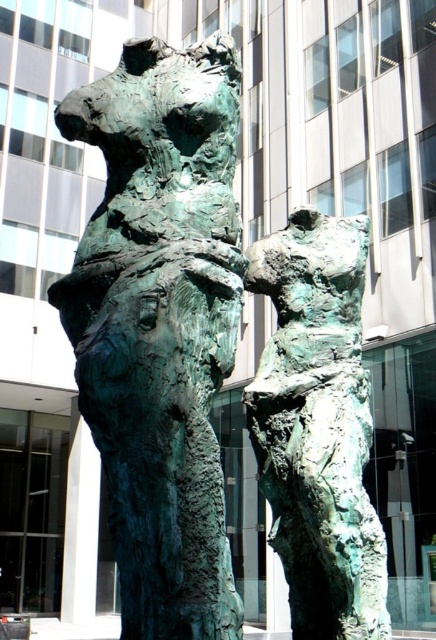
Where is `green patina sculpture at center`? green patina sculpture at center is located at coordinates (160, 324).

Does point (126, 369) come behind point (344, 378)?

That is False.

Does point (81, 122) come in front of point (293, 529)?

That is True.

This screenshot has height=640, width=436. What are the coordinates of `green patina sculpture at center` in the screenshot? It's located at coord(160,324).